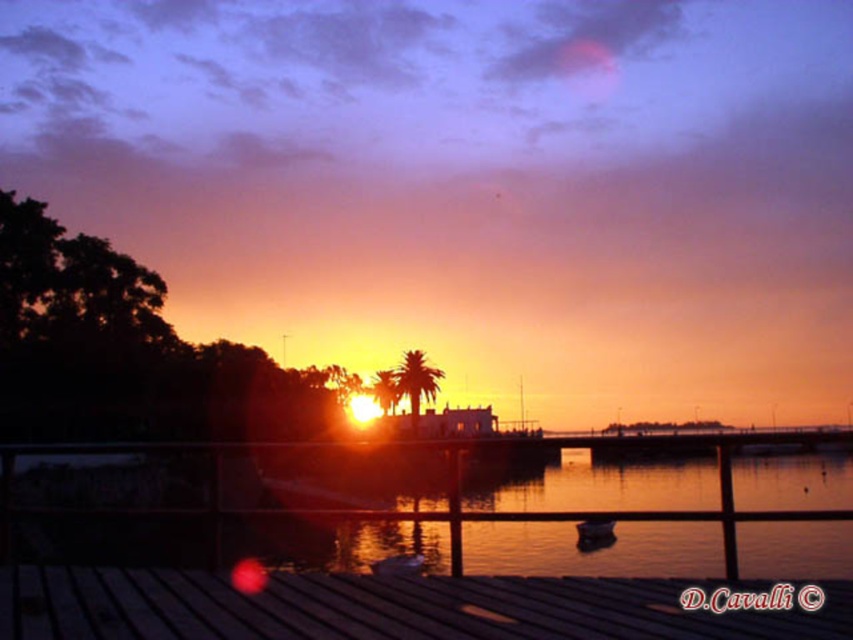
From the picture: You are a delivery person who needs to transport a 7.5 meter long container from the wooden at lower center to the wooden boat at center. Can you move the container between them without bending it?

The wooden at lower center and wooden boat at center are 6.88 meters apart. Since the container is 7.5 meters long, it is longer than the distance between them, so you cannot move the container without bending it.

You are a photographer trying to capture the sunset. You have a camera with a 12MP sensor. The wooden at lower center and wooden boat at center are both in your frame. Which object will appear larger in your photo?

The wooden boat at center will appear larger in the photo because it is larger than the wooden at lower center.